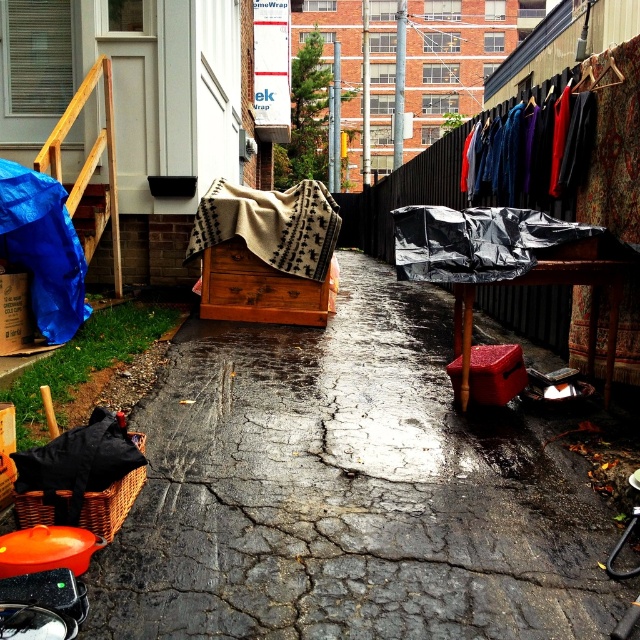
Who is more distant from viewer, (301,442) or (467,396)?

The point (467,396) is more distant.

Is point (440, 538) less distant than point (508, 392)?

Yes.

Locate an element on the screen. The image size is (640, 640). dark gray asphalt at center is located at coordinates (348, 492).

Where is `dark gray asphalt at center`? This screenshot has height=640, width=640. dark gray asphalt at center is located at coordinates (348, 492).

Which is in front, point (257, 278) or point (125, 488)?

Point (125, 488) is in front.

Find the location of a particular element. wooden chest at center is located at coordinates (257, 289).

The width and height of the screenshot is (640, 640). I want to click on wooden chest at center, so click(257, 289).

Which is more to the left, wooden chest at center or wooden staircase at left?

wooden staircase at left

Between point (305, 321) and point (100, 193), which one is positioned behind?

The point (100, 193) is behind.

Where is `wooden chest at center`? wooden chest at center is located at coordinates (257, 289).